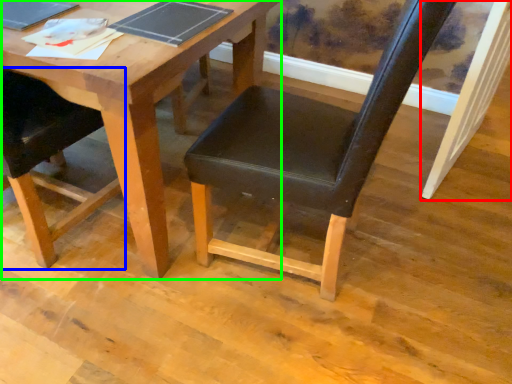
Question: Considering the real-world distances, which object is closest to plank (highlighted by a red box)? chair (highlighted by a blue box) or table (highlighted by a green box).

Choices:
 (A) chair
 (B) table

Answer: (B)